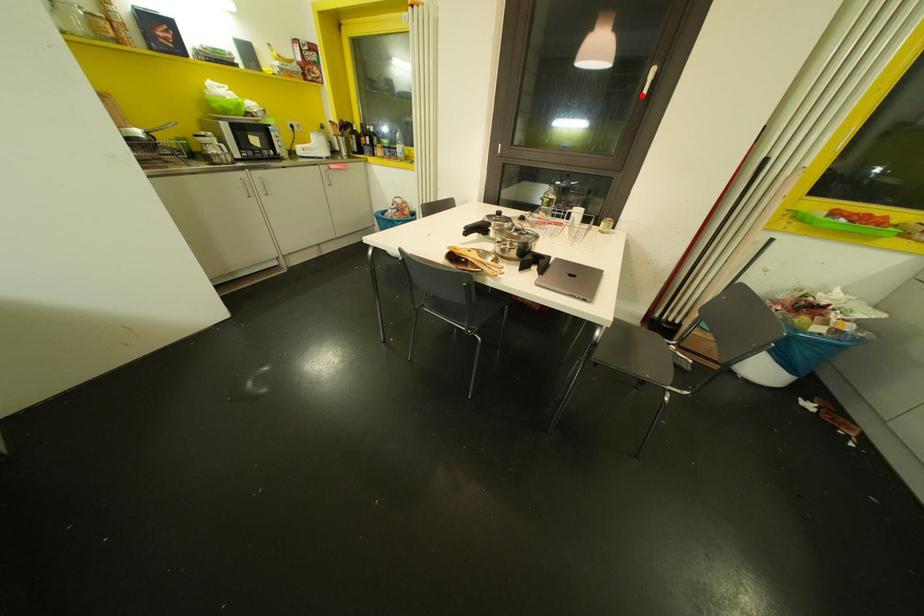
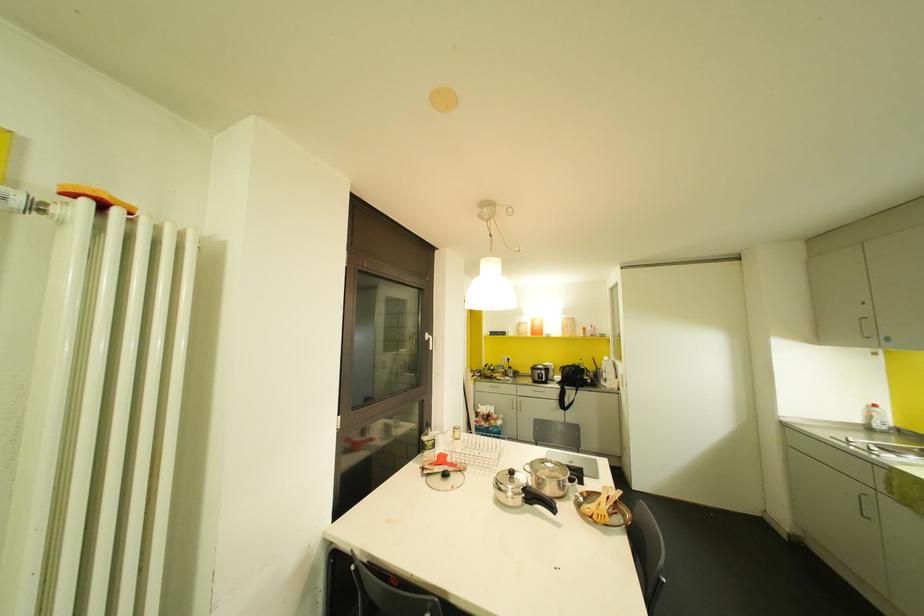
In the second image, find the point that corresponds to the highlighted location in the first image.

(430, 347)